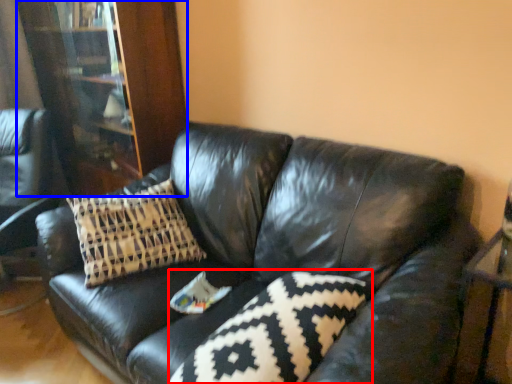
Question: Which object is closer to the camera taking this photo, pillow (highlighted by a red box) or bookcase (highlighted by a blue box)?

Choices:
 (A) pillow
 (B) bookcase

Answer: (A)